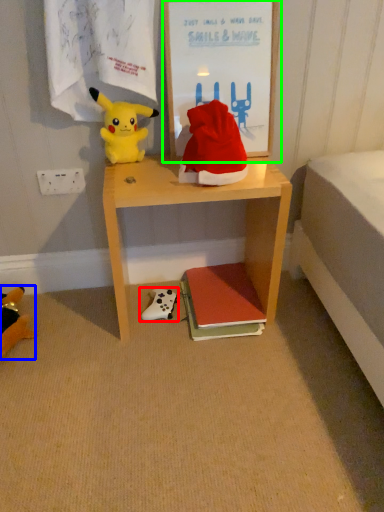
Question: Based on their relative distances, which object is farther from toy (highlighted by a red box)? Choose from toy (highlighted by a blue box) and picture frame (highlighted by a green box).

Choices:
 (A) toy
 (B) picture frame

Answer: (B)